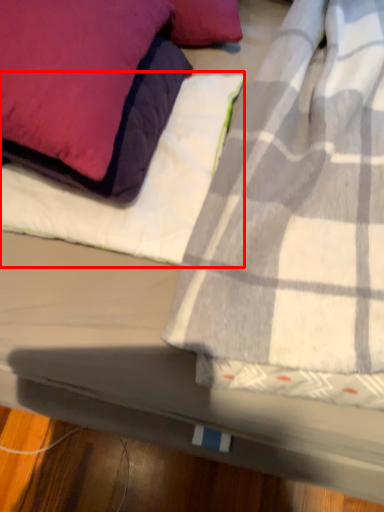
Question: From the image's perspective, where is sheet (annotated by the red box) located relative to pillow?

Choices:
 (A) above
 (B) below

Answer: (B)